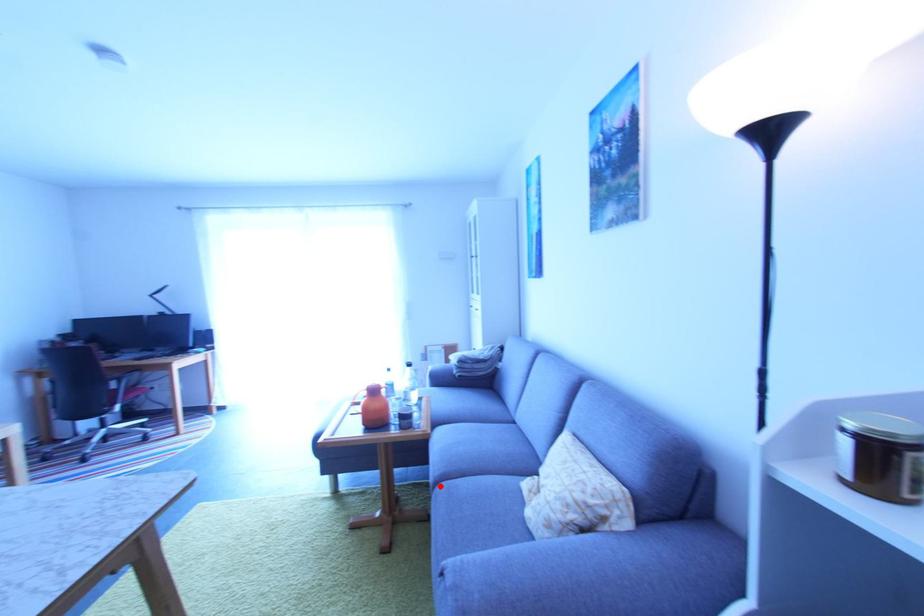
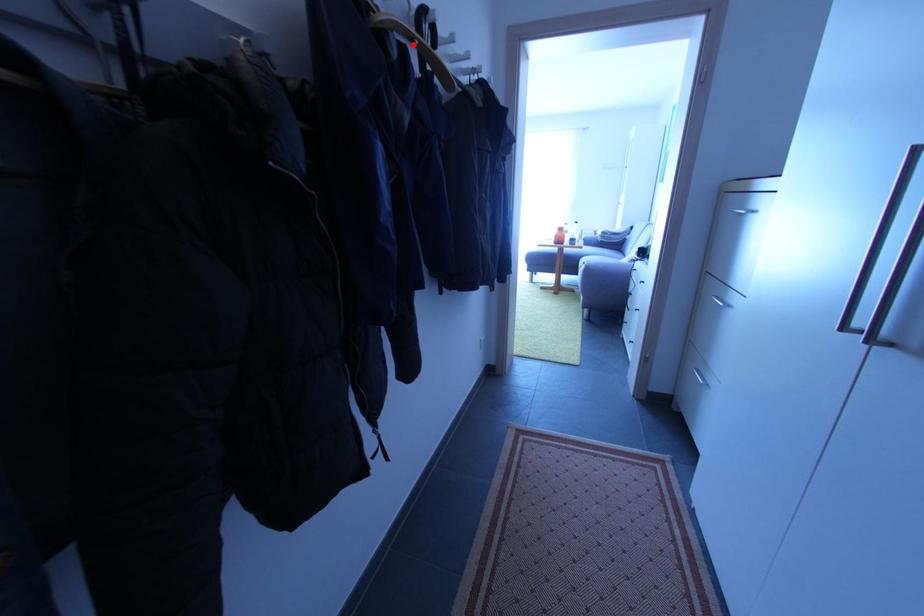
I am providing you with two images of the same scene from different viewpoints. A red point is marked on the first image and another point is marked on the second image. Is the red point in image1 aligned with the point shown in image2?

No